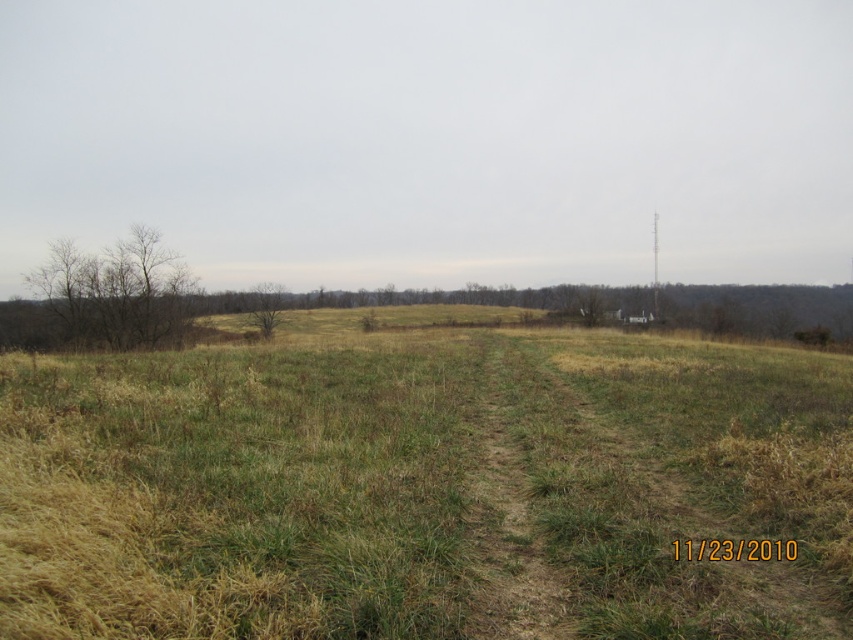
Is green grassy field at center wider than brown dirt trail at center?

Yes.

Is green grassy field at center above brown dirt trail at center?

Yes, green grassy field at center is above brown dirt trail at center.

Which is in front, point (323, 429) or point (490, 448)?

Point (323, 429)

In order to click on green grassy field at center in this screenshot , I will do tap(428, 490).

Describe the element at coordinates (428, 490) in the screenshot. I see `green grassy field at center` at that location.

Which of these two, green grassy field at center or brown rough tree at center, stands taller?

Standing taller between the two is brown rough tree at center.

Does point (131, 380) come farther from viewer compared to point (265, 305)?

No, (131, 380) is in front of (265, 305).

Identify the location of green grassy field at center. The image size is (853, 640). (428, 490).

Does brown dirt trail at center come in front of brown rough tree at center?

Yes, it is.

Does brown dirt trail at center lie behind brown rough tree at center?

No, it is in front of brown rough tree at center.

This screenshot has height=640, width=853. In order to click on brown dirt trail at center in this screenshot , I will do `click(512, 506)`.